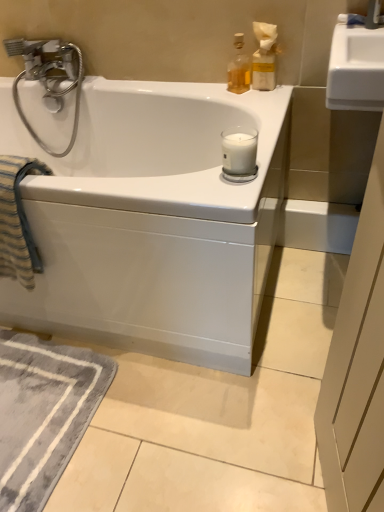
Where is `free spot in front of translucent glass bottle at upper right, acting as the first bottle starting from the left`? free spot in front of translucent glass bottle at upper right, acting as the first bottle starting from the left is located at coordinates point(248,100).